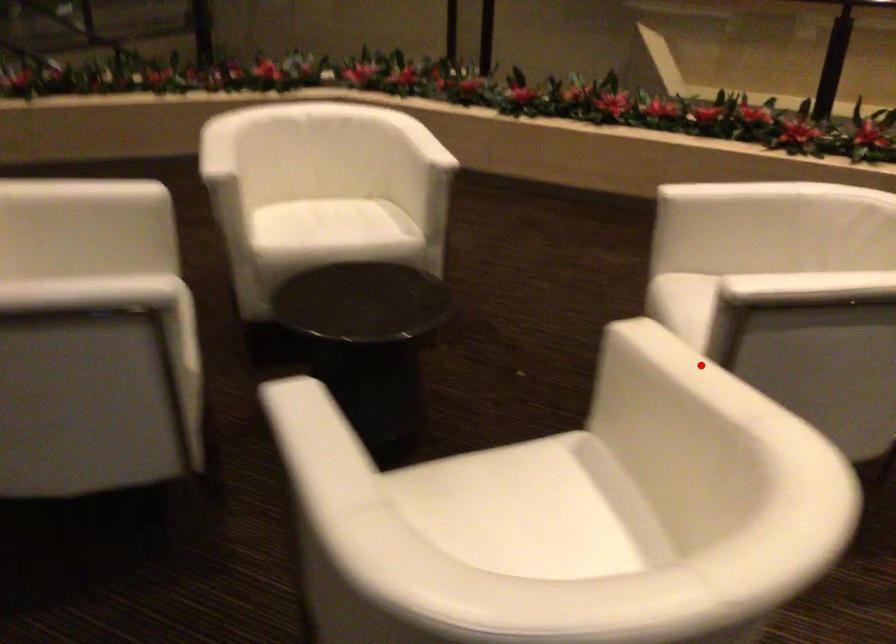
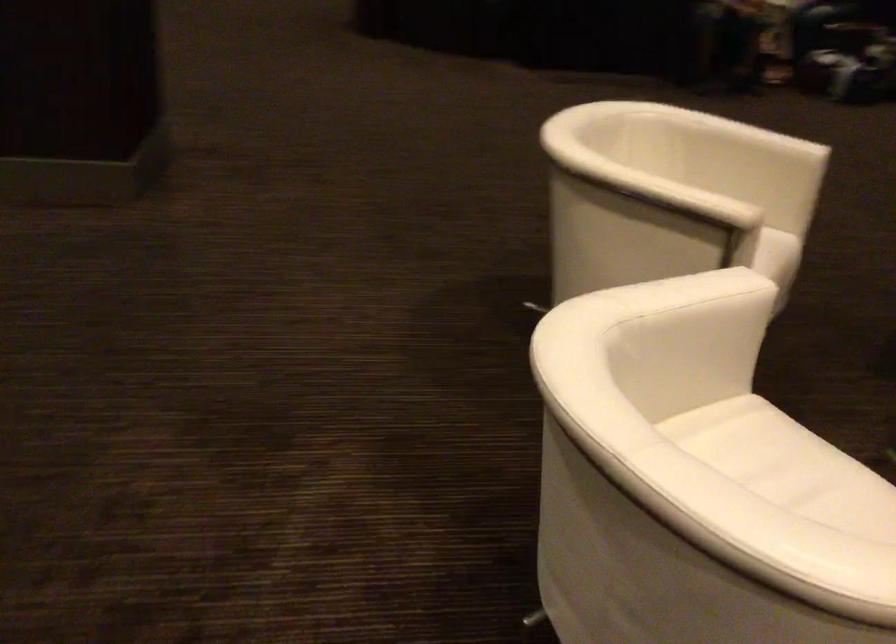
The point at the highlighted location is marked in the first image. Where is the corresponding point in the second image?

(675, 194)